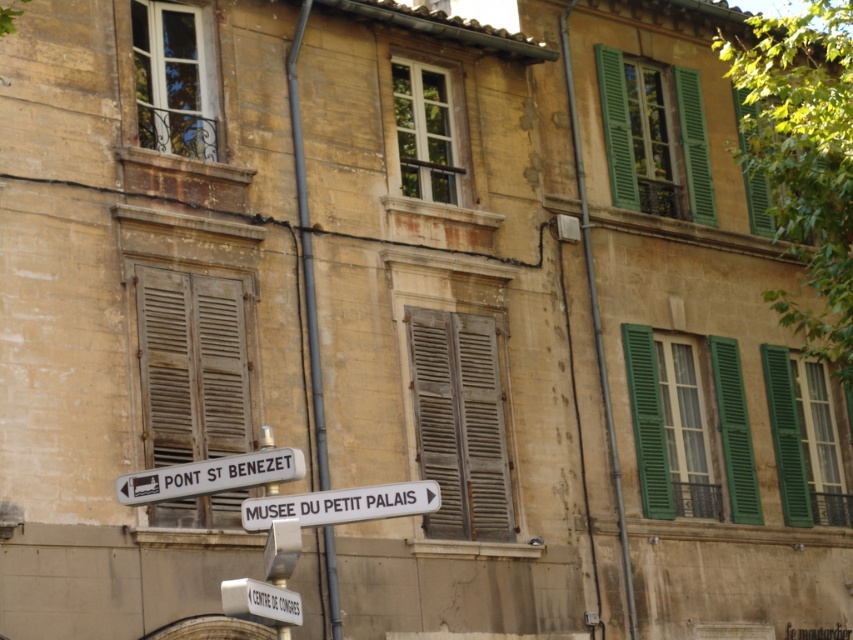
You are a delivery driver who needs to navigate through a narrow alley. Your vehicle is 2 meters tall. You see the green wooden shutters at upper center and the white plastic sign at lower left. Based on their heights, will your vehicle clear both objects without hitting them?

The green wooden shutters at upper center has a lesser height compared to white plastic sign at lower left. Since the white plastic sign at lower left is taller, and the vehicle is 2 meters tall, it depends on the actual height of the taller object. However, since the description only states a comparison between the two and not their exact heights, we cannot definitively determine if the vehicle will clear both. More information is needed about the actual height measurements of the objects.

You are a painter hired to restore the green wooden shutters at upper center and the green wooden shutters at right. You have a limited amount of paint. Which of the two shutters will require more paint due to its size?

The green wooden shutters at upper center will require more paint because it is bigger than the green wooden shutters at right.